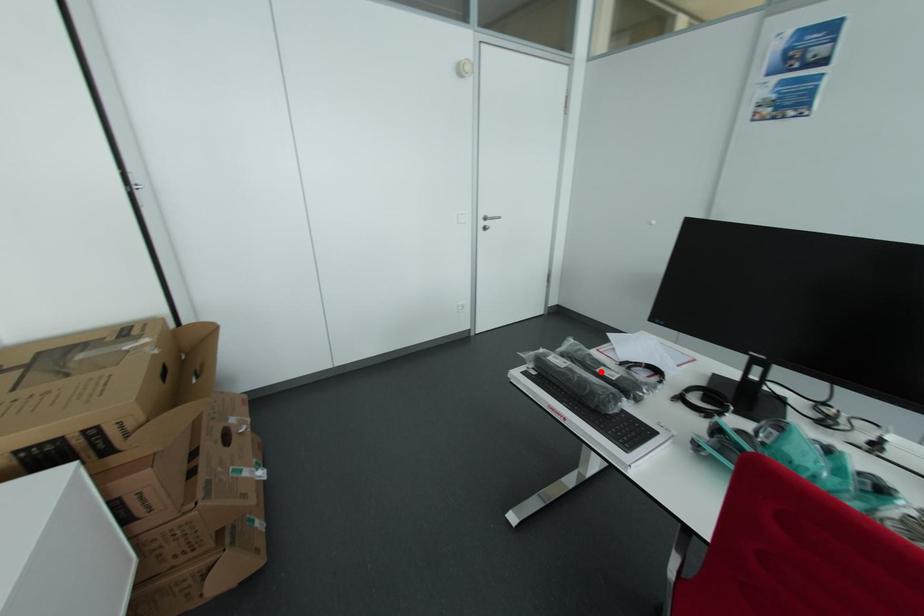
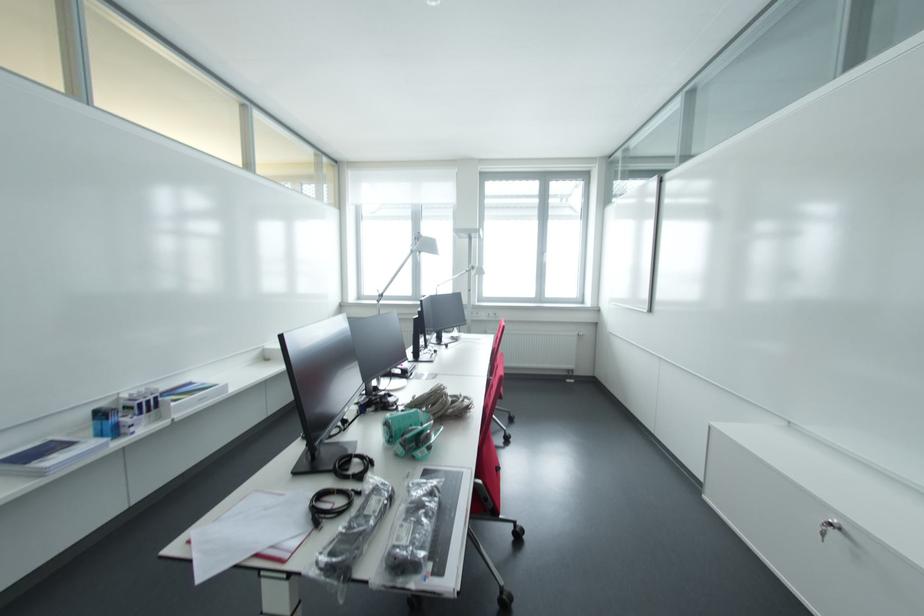
Question: I am providing you with two images of the same scene from different viewpoints. A red point is marked on the first image. Is the red point's position out of view in image 2?

Choices:
 (A) Yes
 (B) No

Answer: (B)